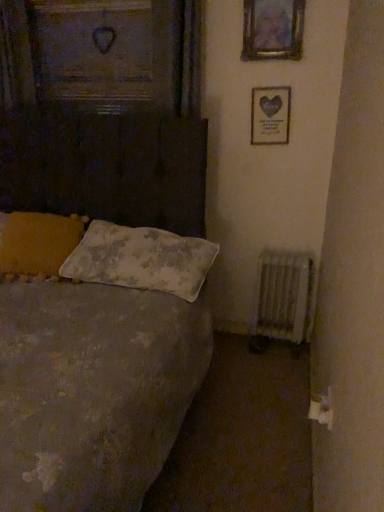
Question: Considering the relative sizes of textured gray bed at left and fluffy white pillow at left, the second pillow in the right-to-left sequence, in the image provided, is textured gray bed at left smaller than fluffy white pillow at left, the second pillow in the right-to-left sequence,?

Choices:
 (A) no
 (B) yes

Answer: (A)

Question: Is textured gray bed at left at the right side of fluffy white pillow at left, the second pillow in the right-to-left sequence?

Choices:
 (A) yes
 (B) no

Answer: (A)

Question: Considering the relative positions of textured gray bed at left and fluffy white pillow at left, the second pillow in the right-to-left sequence, in the image provided, is textured gray bed at left to the left of fluffy white pillow at left, the second pillow in the right-to-left sequence, from the viewer's perspective?

Choices:
 (A) no
 (B) yes

Answer: (A)

Question: Is textured gray bed at left bigger than fluffy white pillow at left, which is the 1th pillow in left-to-right order?

Choices:
 (A) no
 (B) yes

Answer: (B)

Question: Is textured gray bed at left far from fluffy white pillow at left, which is the 1th pillow in left-to-right order?

Choices:
 (A) no
 (B) yes

Answer: (A)

Question: Is textured gray bed at left looking in the opposite direction of fluffy white pillow at left, the second pillow in the right-to-left sequence?

Choices:
 (A) yes
 (B) no

Answer: (A)

Question: Considering the relative sizes of white textured radiator at lower right and metallic silver picture frame at upper center, the first picture frame from the front, in the image provided, is white textured radiator at lower right smaller than metallic silver picture frame at upper center, the first picture frame from the front,?

Choices:
 (A) no
 (B) yes

Answer: (A)

Question: Would you say white textured radiator at lower right is a long distance from metallic silver picture frame at upper center, the first picture frame in the top-to-bottom sequence?

Choices:
 (A) no
 (B) yes

Answer: (B)

Question: Could you tell me if white textured radiator at lower right is facing metallic silver picture frame at upper center, the first picture frame in the top-to-bottom sequence?

Choices:
 (A) no
 (B) yes

Answer: (A)

Question: From a real-world perspective, is white textured radiator at lower right located higher than metallic silver picture frame at upper center, arranged as the second picture frame when ordered from the bottom?

Choices:
 (A) yes
 (B) no

Answer: (B)

Question: Is white textured radiator at lower right at the left side of metallic silver picture frame at upper center, the first picture frame from the front?

Choices:
 (A) no
 (B) yes

Answer: (A)

Question: Does white textured radiator at lower right lie in front of metallic silver picture frame at upper center, marked as the second picture frame in a back-to-front arrangement?

Choices:
 (A) yes
 (B) no

Answer: (B)

Question: Can you confirm if metallic silver picture frame at upper center, the first picture frame from the front, is positioned to the right of matte silver picture frame at upper right, which is counted as the second picture frame, starting from the top?

Choices:
 (A) no
 (B) yes

Answer: (A)